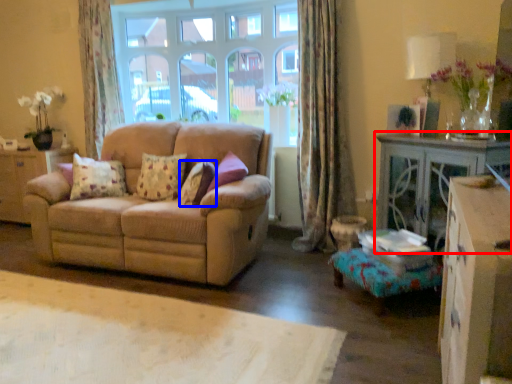
Question: Which of the following is the farthest to the observer, table (highlighted by a red box) or pillow (highlighted by a blue box)?

Choices:
 (A) table
 (B) pillow

Answer: (B)